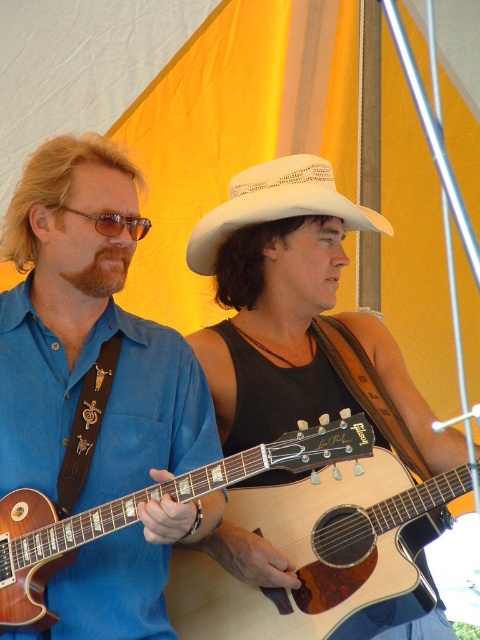
Question: Is white woven cowboy hat at center positioned at the back of brownwoodybeard at left?

Choices:
 (A) no
 (B) yes

Answer: (B)

Question: Based on their relative distances, which object is farther from the matte brown guitar at left?

Choices:
 (A) brownwoodybeard at left
 (B) matte brown guitar at center
 (C) white woven cowboy hat at center

Answer: (C)

Question: Does wooden acoustic guitar at center have a larger size compared to brownwoodybeard at left?

Choices:
 (A) yes
 (B) no

Answer: (A)

Question: Does white woven cowboy hat at center have a greater width compared to matte brown sunglasses at left?

Choices:
 (A) no
 (B) yes

Answer: (B)

Question: Which object appears farthest from the camera in this image?

Choices:
 (A) wooden acoustic guitar at center
 (B) matte brown guitar at center

Answer: (B)

Question: Among these points, which one is nearest to the camera?

Choices:
 (A) (39, 588)
 (B) (144, 230)
 (C) (78, 499)

Answer: (A)